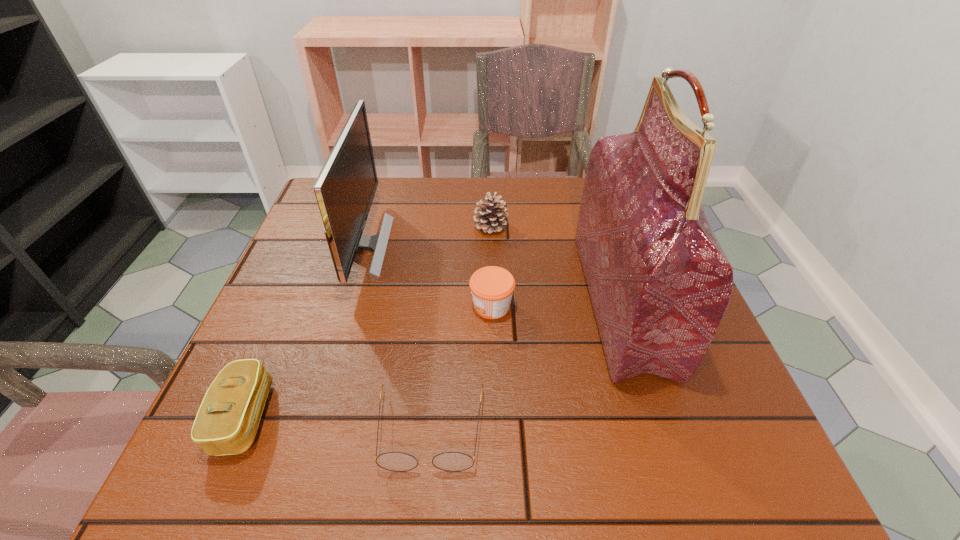
Image resolution: width=960 pixels, height=540 pixels. Identify the location of the fifth closest object to the pinecone. [x=228, y=418].

Where is `object that stands as the second closest to the monitor`? object that stands as the second closest to the monitor is located at coordinates (x=492, y=287).

Where is `vacant space that satisfies the following two spatial constraints: 1. on the front label of the jam; 2. on the temples of the spectacles`? This screenshot has height=540, width=960. vacant space that satisfies the following two spatial constraints: 1. on the front label of the jam; 2. on the temples of the spectacles is located at coordinates (495, 430).